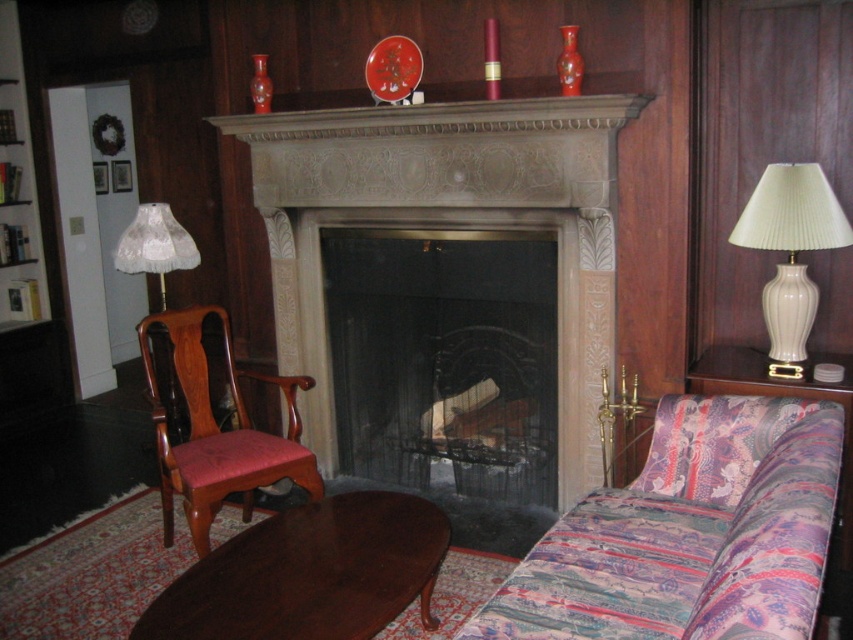
Question: Can you confirm if mahogany wood coffee table at lower center is thinner than white ceramic lamp at right?

Choices:
 (A) no
 (B) yes

Answer: (A)

Question: Which point is farther from the camera taking this photo?

Choices:
 (A) (221, 467)
 (B) (131, 221)

Answer: (B)

Question: Considering the relative positions of stone fireplace at center and white lace lampshade at left in the image provided, where is stone fireplace at center located with respect to white lace lampshade at left?

Choices:
 (A) below
 (B) above

Answer: (A)

Question: From the image, what is the correct spatial relationship of mahogany wood armchair at left in relation to white lace lampshade at left?

Choices:
 (A) right
 (B) left

Answer: (A)

Question: Based on their relative distances, which object is nearer to the patterned fabric couch at lower right?

Choices:
 (A) mahogany wood armchair at left
 (B) stone fireplace at center
 (C) white lace lampshade at left
 (D) mahogany wood coffee table at lower center

Answer: (D)

Question: Among these objects, which one is farthest from the camera?

Choices:
 (A) mahogany wood coffee table at lower center
 (B) white lace lampshade at left

Answer: (B)